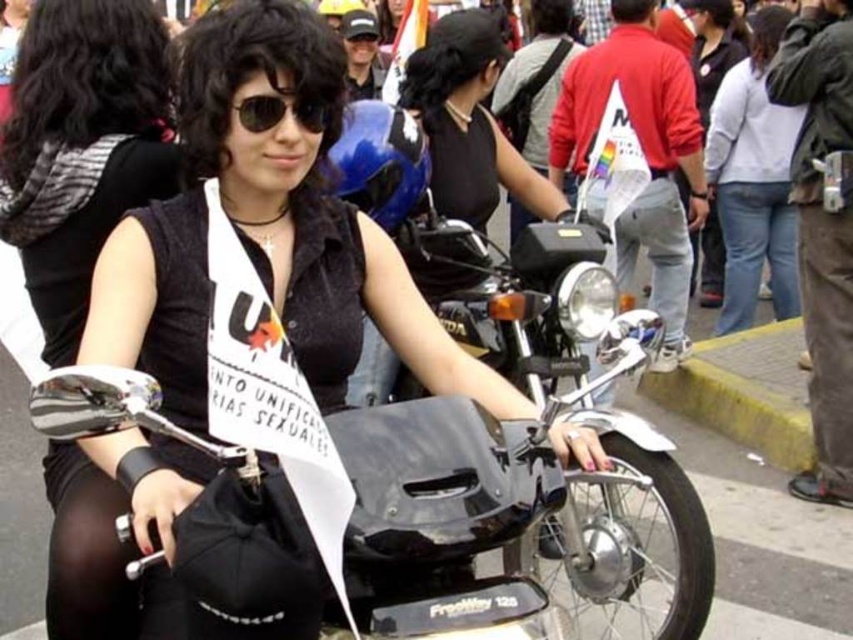
Question: Based on their relative distances, which object is farther from the black matte helmet at upper center?

Choices:
 (A) white cotton shirt at upper right
 (B) matte black sunglasses at center
 (C) jeans at right

Answer: (C)

Question: Which point appears closest to the camera in this image?

Choices:
 (A) (448, 164)
 (B) (271, 99)

Answer: (B)

Question: Is white cotton shirt at upper right to the right of jeans at right from the viewer's perspective?

Choices:
 (A) yes
 (B) no

Answer: (A)

Question: Observing the image, what is the correct spatial positioning of matte black vest at center in reference to white cotton shirt at upper right?

Choices:
 (A) left
 (B) right

Answer: (A)

Question: Which of the following is the closest to the observer?

Choices:
 (A) [x=245, y=122]
 (B) [x=740, y=163]
 (C) [x=755, y=188]
 (D) [x=312, y=365]

Answer: (A)

Question: Is matte black vest at center wider than matte black sunglasses at center?

Choices:
 (A) yes
 (B) no

Answer: (A)